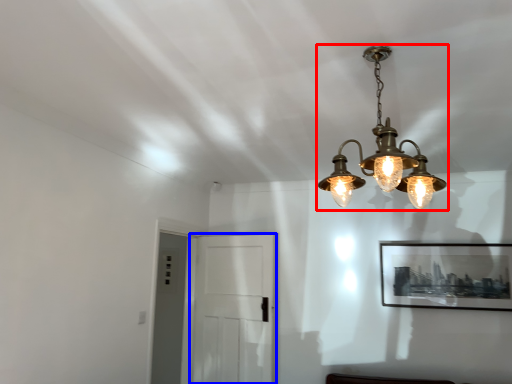
Question: Which point is closer to the camera, lamp (highlighted by a red box) or glass door (highlighted by a blue box)?

Choices:
 (A) lamp
 (B) glass door

Answer: (A)